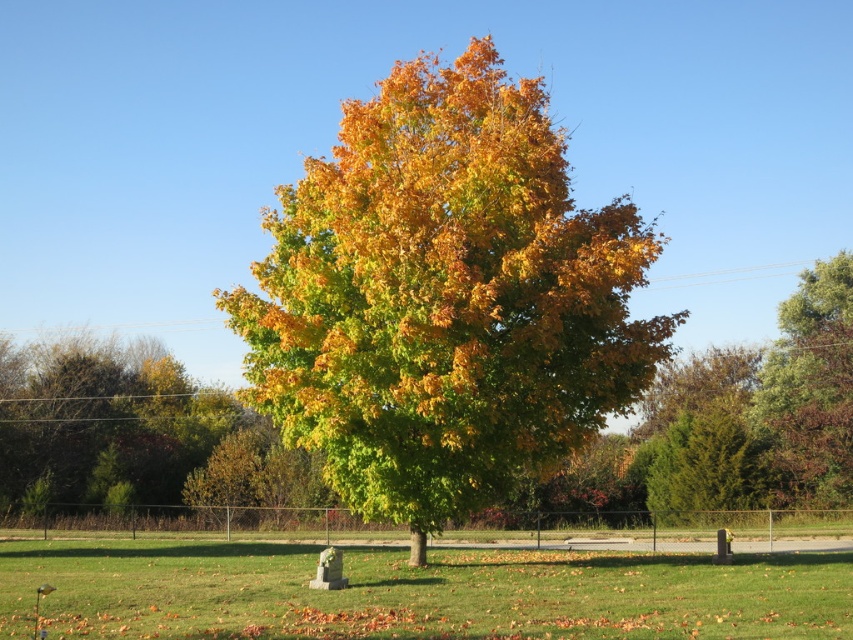
Is yellow-green foliage at center further to camera compared to green grass at center?

Yes, it is.

Between yellow-green foliage at center and green grass at center, which one appears on the left side from the viewer's perspective?

From the viewer's perspective, green grass at center appears more on the left side.

Measure the distance between yellow-green foliage at center and camera.

yellow-green foliage at center is 15.55 meters from camera.

Find the location of a particular element. The height and width of the screenshot is (640, 853). yellow-green foliage at center is located at coordinates (444, 298).

Which of these two, yellow-green foliage at center or green matte tree at right, stands shorter?

Standing shorter between the two is green matte tree at right.

Does yellow-green foliage at center appear on the left side of green matte tree at right?

Indeed, yellow-green foliage at center is positioned on the left side of green matte tree at right.

This screenshot has height=640, width=853. What do you see at coordinates (444, 298) in the screenshot?
I see `yellow-green foliage at center` at bounding box center [444, 298].

You are a GUI agent. You are given a task and a screenshot of the screen. Output one action in this format:
    pyautogui.click(x=<x>, y=<y>)
    Task: Click on the yellow-green foliage at center
    
    Given the screenshot: What is the action you would take?
    pyautogui.click(x=444, y=298)

Does green grass at center appear on the left side of green matte tree at right?

Yes, green grass at center is to the left of green matte tree at right.

Can you confirm if green grass at center is shorter than green matte tree at right?

Yes.

Between point (289, 557) and point (785, 365), which one is positioned behind?

Positioned behind is point (785, 365).

Locate an element on the screen. green grass at center is located at coordinates click(x=415, y=593).